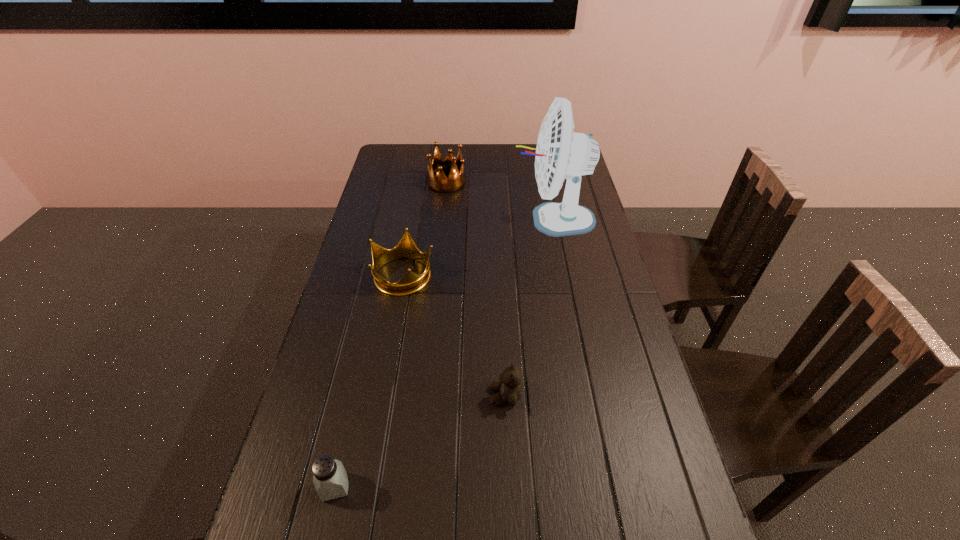
The width and height of the screenshot is (960, 540). Identify the location of vacant space located 0.260m on the grille of the fourth nearest object. (441, 220).

I want to click on vacant region located 0.380m on the grille of the fourth nearest object, so tap(408, 220).

Find the location of `vacant region located 0.280m on the right of the farthest object`. vacant region located 0.280m on the right of the farthest object is located at coordinates (533, 183).

The height and width of the screenshot is (540, 960). Find the location of `vacant position located on the face of the fourth farthest object`. vacant position located on the face of the fourth farthest object is located at coordinates (367, 396).

The width and height of the screenshot is (960, 540). In order to click on free space located on the face of the fourth farthest object in this screenshot , I will do `click(438, 396)`.

Where is `vacant space positioned on the face of the fourth farthest object`? This screenshot has width=960, height=540. vacant space positioned on the face of the fourth farthest object is located at coordinates (458, 396).

Identify the location of vacant space located 0.230m on the back of the shorter crown. (415, 214).

Where is `vacant space located 0.190m on the right of the saltshaker`? Image resolution: width=960 pixels, height=540 pixels. vacant space located 0.190m on the right of the saltshaker is located at coordinates (437, 487).

Identify the location of crown situated at the left edge. This screenshot has height=540, width=960. (411, 282).

The height and width of the screenshot is (540, 960). I want to click on saltshaker positioned at the left edge, so click(330, 479).